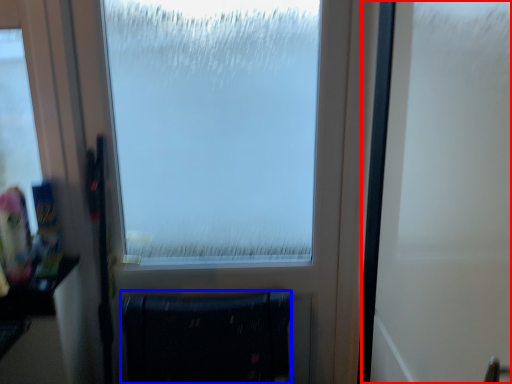
Question: Which point is further to the camera, screen door (highlighted by a red box) or furniture (highlighted by a blue box)?

Choices:
 (A) screen door
 (B) furniture

Answer: (B)